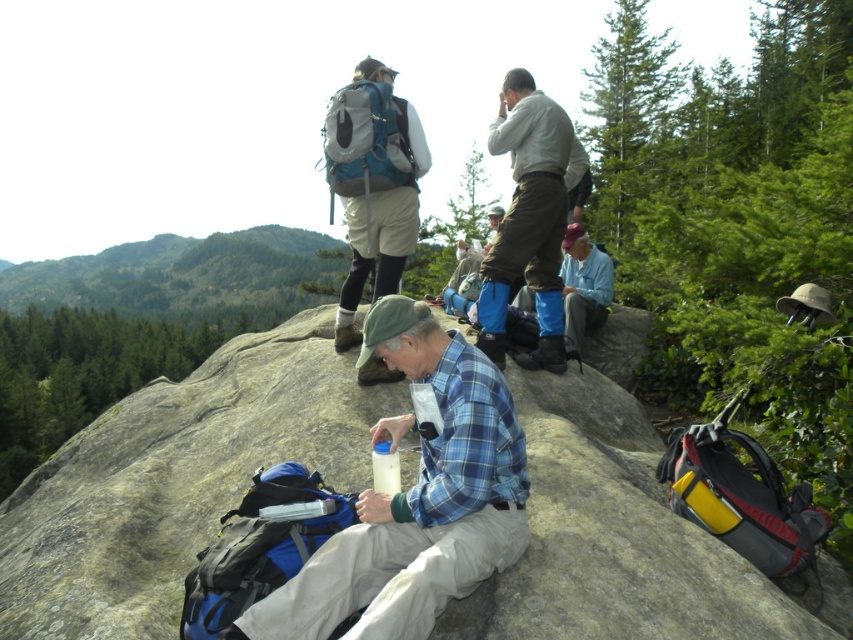
Does matte gray shirt at upper center appear on the right side of light blue flannel shirt at center?

In fact, matte gray shirt at upper center is to the left of light blue flannel shirt at center.

Is matte gray shirt at upper center positioned in front of light blue flannel shirt at center?

That is True.

Which is in front, point (509, 269) or point (585, 323)?

Point (509, 269)

Where is `matte gray shirt at upper center`? The image size is (853, 640). matte gray shirt at upper center is located at coordinates (529, 220).

Who is more distant from viewer, [577,445] or [410,502]?

The point [577,445] is behind.

Locate an element on the screen. The width and height of the screenshot is (853, 640). smooth gray rock at center is located at coordinates (175, 481).

Which is more to the left, smooth gray rock at center or matte gray shirt at upper center?

From the viewer's perspective, smooth gray rock at center appears more on the left side.

Is smooth gray rock at center further to the viewer compared to matte gray shirt at upper center?

No, smooth gray rock at center is in front of matte gray shirt at upper center.

Image resolution: width=853 pixels, height=640 pixels. I want to click on smooth gray rock at center, so click(175, 481).

In order to click on smooth gray rock at center in this screenshot , I will do `click(175, 481)`.